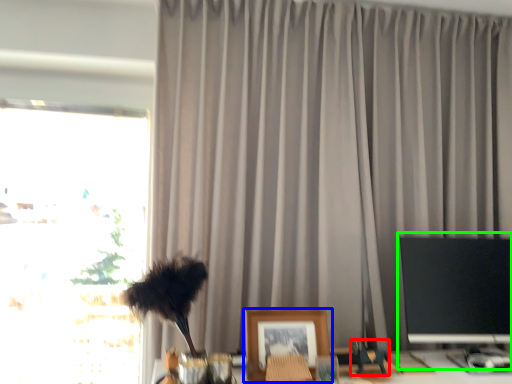
Question: Based on their relative distances, which object is farther from toy (highlighted by a red box)? Choose from picture frame (highlighted by a blue box) and computer monitor (highlighted by a green box).

Choices:
 (A) picture frame
 (B) computer monitor

Answer: (B)